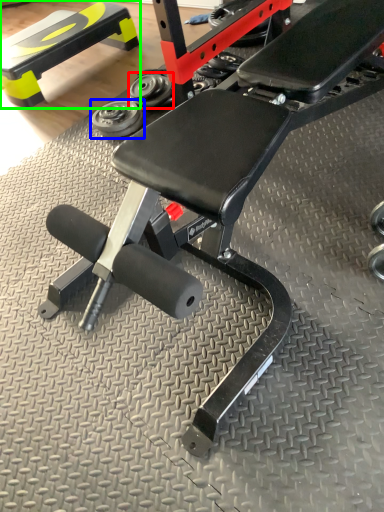
Question: Estimate the real-world distances between objects in this image. Which object is closer to dumbbell (highlighted by a red box), dumbbell (highlighted by a blue box) or bench (highlighted by a green box)?

Choices:
 (A) dumbbell
 (B) bench

Answer: (A)